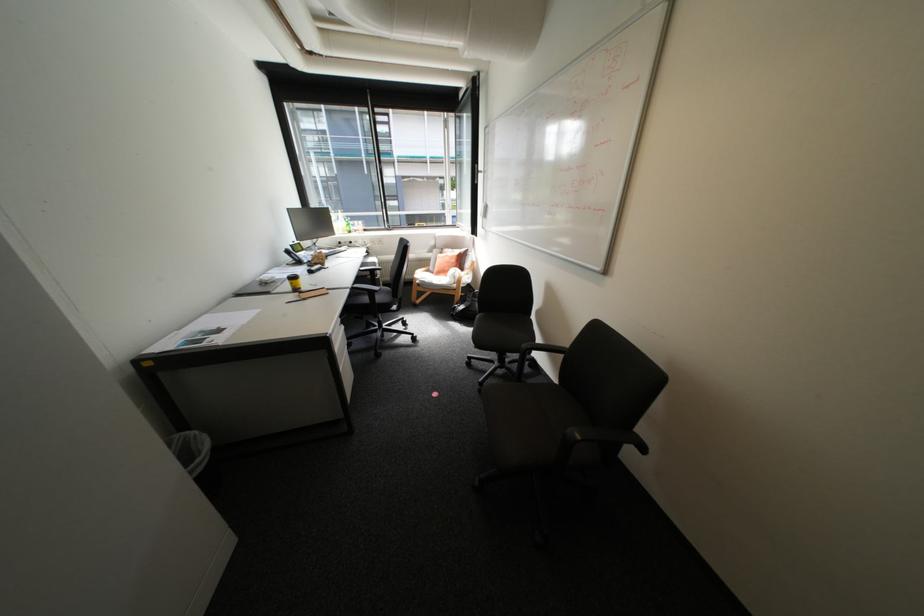
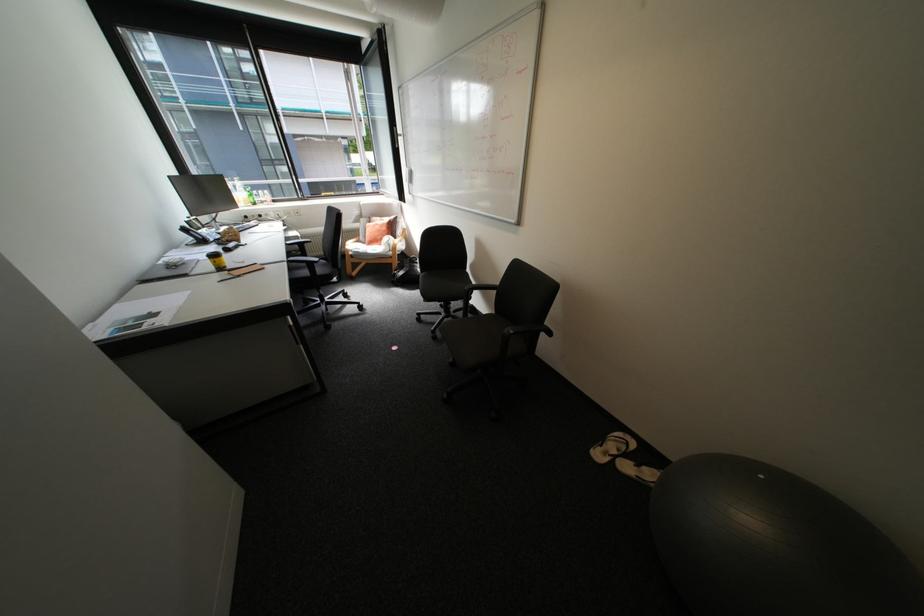
Find the pixel in the second image that matches (271,277) in the first image.

(176, 260)